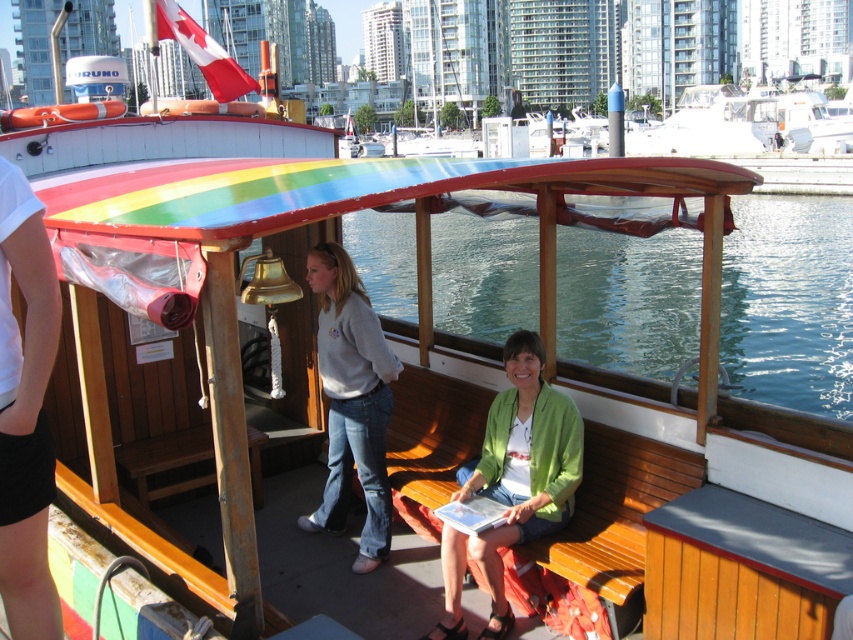
Question: Which of the following is the closest to the observer?

Choices:
 (A) pyautogui.click(x=627, y=358)
 (B) pyautogui.click(x=321, y=364)

Answer: (B)

Question: Which is farther from the green fabric jacket at center?

Choices:
 (A) transparent glass water at center
 (B) gray sweatshirt at center

Answer: (A)

Question: Does transparent glass water at center come in front of gray sweatshirt at center?

Choices:
 (A) yes
 (B) no

Answer: (A)

Question: Does green fabric jacket at center have a lesser width compared to gray sweatshirt at center?

Choices:
 (A) yes
 (B) no

Answer: (B)

Question: Does transparent glass water at center appear over gray sweatshirt at center?

Choices:
 (A) no
 (B) yes

Answer: (B)

Question: Which point is farther to the camera?

Choices:
 (A) green fabric jacket at center
 (B) gray sweatshirt at center

Answer: (B)